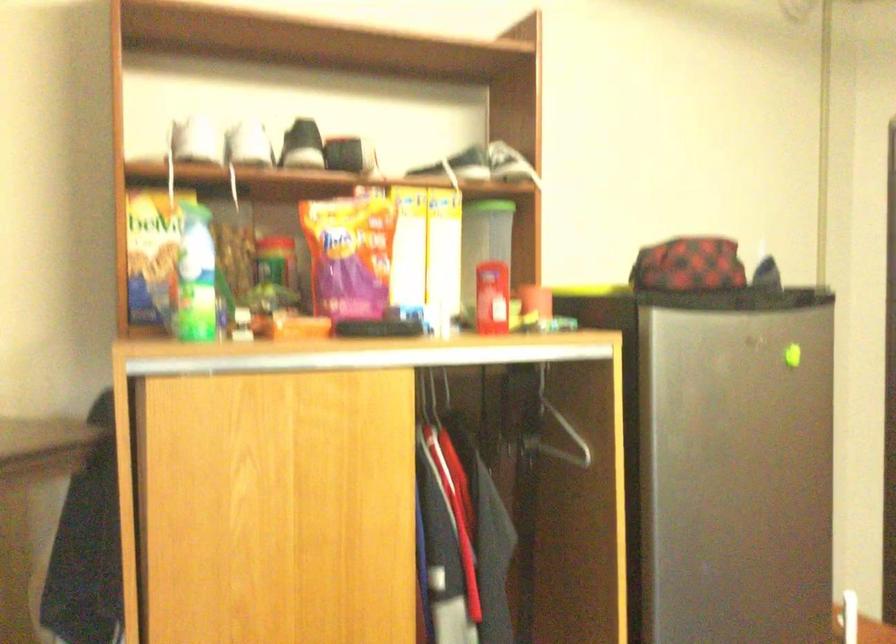
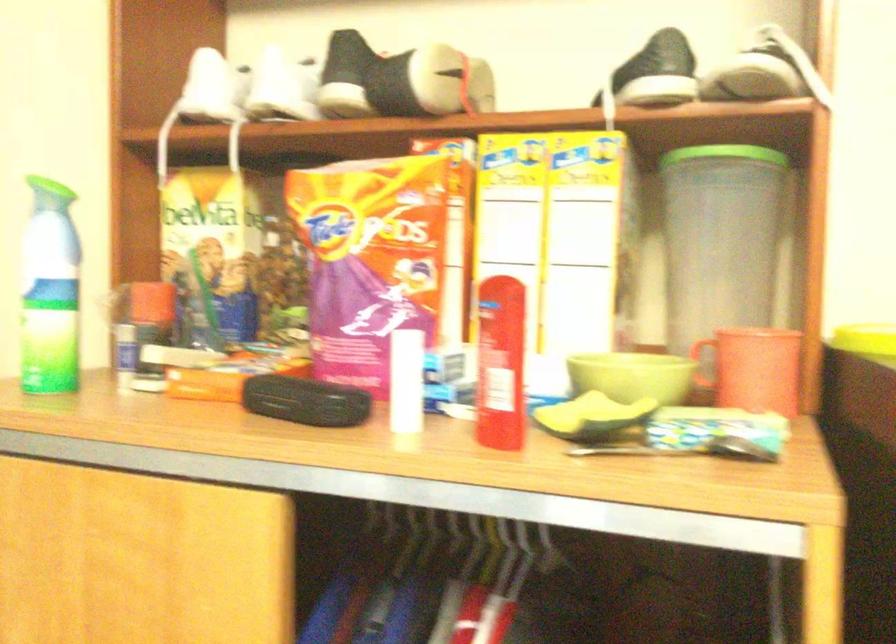
In the second image, find the point that corresponds to [506,307] in the first image.

(633, 375)